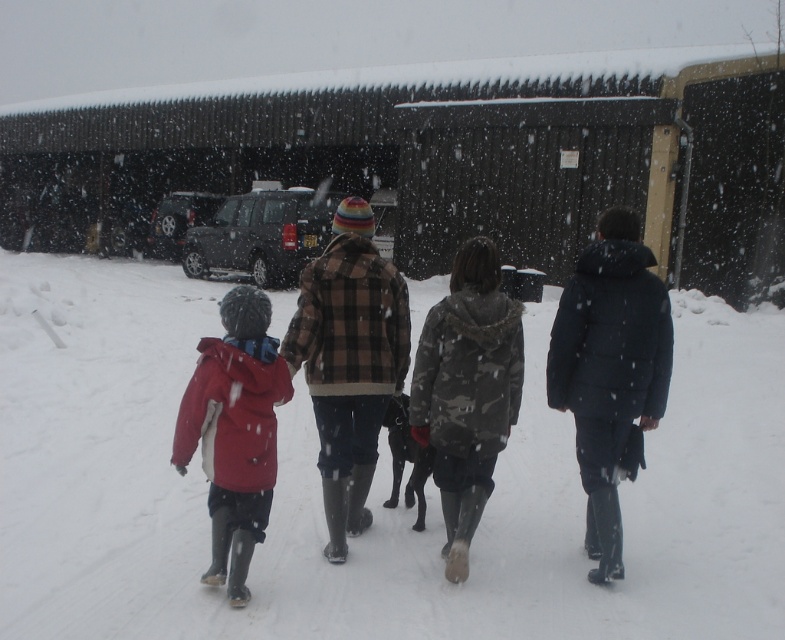
Question: Which object is farther from the camera taking this photo?

Choices:
 (A) red plaid jacket at center
 (B) brown plaid jacket at center
 (C) camo fabric jacket at center
 (D) matte red jacket at left

Answer: (C)

Question: Among these points, which one is nearest to the camera?

Choices:
 (A) (246, 496)
 (B) (371, 374)
 (C) (469, 339)

Answer: (A)

Question: Which point appears closest to the camera in this image?

Choices:
 (A) (469, 305)
 (B) (232, 557)
 (C) (400, 381)
 (D) (192, 442)

Answer: (D)

Question: Does camo fabric jacket at center appear on the left side of matte red jacket at left?

Choices:
 (A) yes
 (B) no

Answer: (B)

Question: Can you confirm if red plaid jacket at center is thinner than brown plaid jacket at center?

Choices:
 (A) yes
 (B) no

Answer: (B)

Question: Considering the relative positions of camo fabric jacket at center and matte red jacket at left in the image provided, where is camo fabric jacket at center located with respect to matte red jacket at left?

Choices:
 (A) left
 (B) right

Answer: (B)